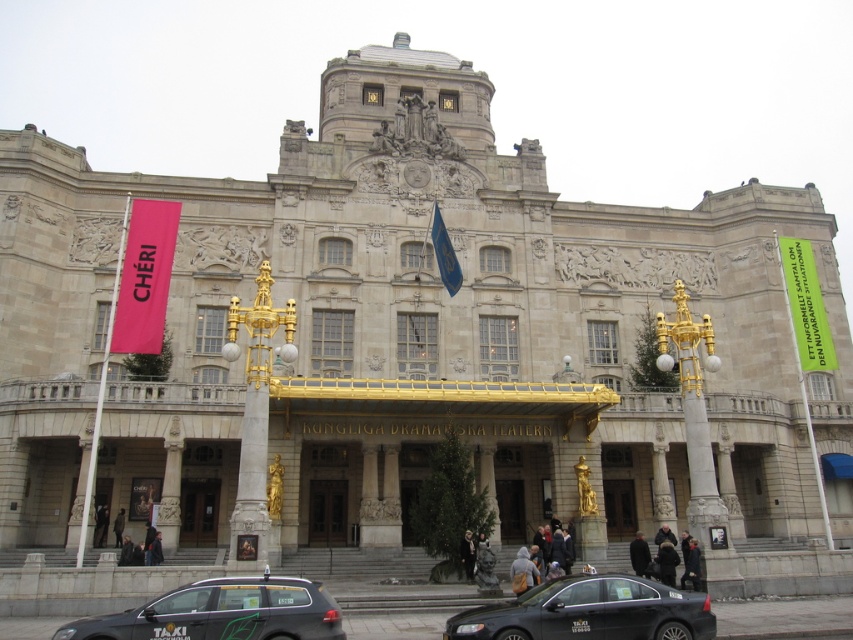
You are a visitor planning to take a photo of the Kungliga Dramatiska Teatern. You want to include both the black metallic taxi at lower center and the green fabric banner at right in your shot. Which object will appear taller in the photo?

The green fabric banner at right appears taller in the photo because the black metallic taxi at lower center is not as tall as the green fabric banner at right.

You are a visitor standing in front of the Kungliga Dramatiska Teatern. You notice two banners hanging from the gold canopy. The banners are labeled as the pink fabric banner at left and the green fabric banner at right. Which banner has a larger size?

The pink fabric banner at left is bigger than the green fabric banner at right.

You are a visitor standing in front of the Kungliga Dramatiska Teatern. You notice two banners, the pink fabric banner at left and the green fabric banner at right. Which banner is placed higher above the other?

The pink fabric banner at left is positioned over the green fabric banner at right, so it is placed higher above the other.